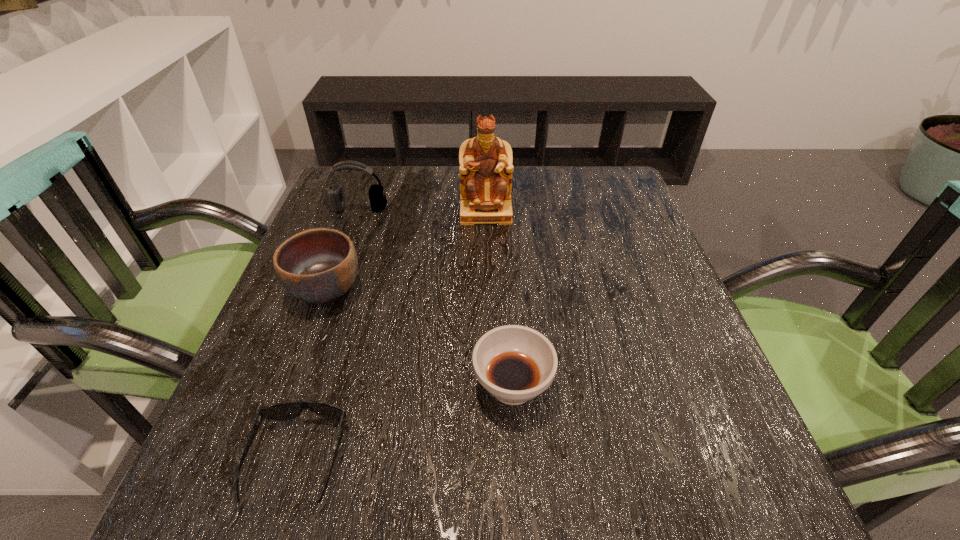
In the image, there is a desktop. Identify the location of vacant area at the left edge. (310, 411).

Where is `free space at the right edge`? Image resolution: width=960 pixels, height=540 pixels. free space at the right edge is located at coordinates (635, 387).

This screenshot has width=960, height=540. In the image, there is a desktop. In order to click on free space at the far left corner in this screenshot , I will do `click(350, 174)`.

Image resolution: width=960 pixels, height=540 pixels. In the image, there is a desktop. Identify the location of vacant space at the far right corner. 593,166.

This screenshot has height=540, width=960. In the image, there is a desktop. Identify the location of vacant space at the near right corner. (718, 500).

This screenshot has height=540, width=960. Identify the location of vacant region between the figurine and the shortest object. 392,336.

Find the location of a particular element. The image size is (960, 540). vacant area that lies between the third shortest object and the tallest object is located at coordinates (406, 251).

Locate an element on the screen. The width and height of the screenshot is (960, 540). vacant area that lies between the second shortest object and the tallest object is located at coordinates (499, 299).

The width and height of the screenshot is (960, 540). In order to click on free space that is in between the soup bowl and the figurine in this screenshot , I will do `click(499, 299)`.

You are a GUI agent. You are given a task and a screenshot of the screen. Output one action in this format:
    pyautogui.click(x=<x>, y=<y>)
    Task: Click on the unoccupied area between the sunglasses and the headset
    The height and width of the screenshot is (540, 960).
    Given the screenshot: What is the action you would take?
    328,334